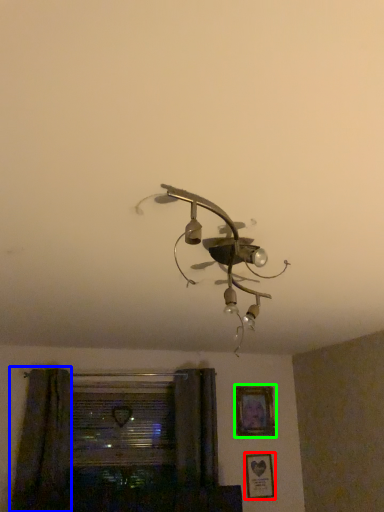
Question: Which is nearer to the picture frame (highlighted by a red box)? curtain (highlighted by a blue box) or picture frame (highlighted by a green box).

Choices:
 (A) curtain
 (B) picture frame

Answer: (B)